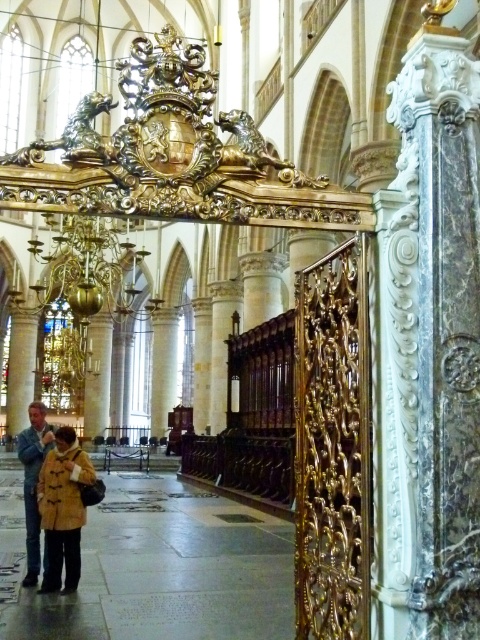
Question: Which object appears farthest from the camera in this image?

Choices:
 (A) brown fuzzy coat at lower left
 (B) brown leather jacket at lower left

Answer: (B)

Question: Which object appears closest to the camera in this image?

Choices:
 (A) brown fuzzy coat at lower left
 (B) brown leather jacket at lower left

Answer: (A)

Question: Can you confirm if brown fuzzy coat at lower left is smaller than brown leather jacket at lower left?

Choices:
 (A) no
 (B) yes

Answer: (B)

Question: Can you confirm if brown fuzzy coat at lower left is positioned to the right of brown leather jacket at lower left?

Choices:
 (A) yes
 (B) no

Answer: (A)

Question: Can you confirm if brown fuzzy coat at lower left is smaller than brown leather jacket at lower left?

Choices:
 (A) yes
 (B) no

Answer: (A)